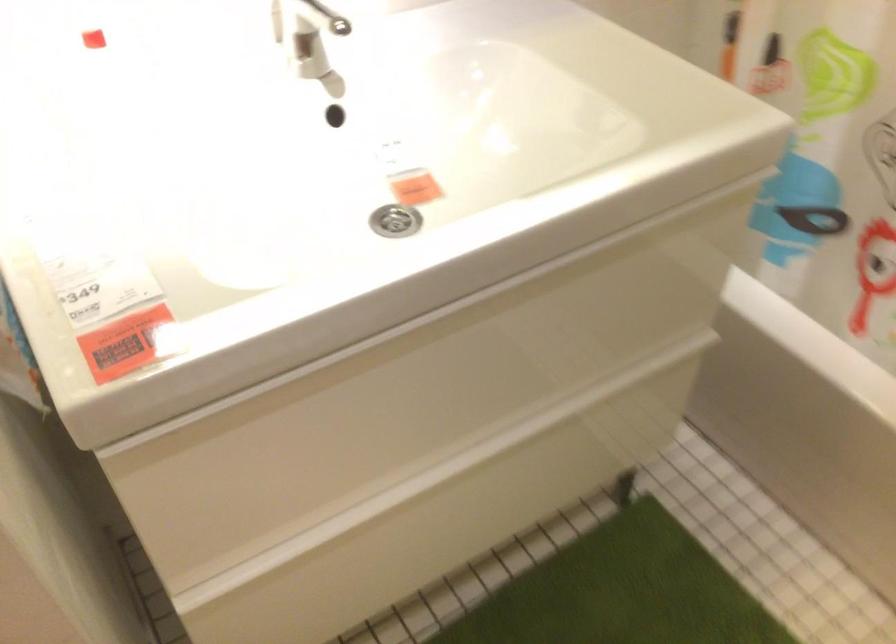
Describe the element at coordinates (329, 17) in the screenshot. The height and width of the screenshot is (644, 896). I see `a faucet handle` at that location.